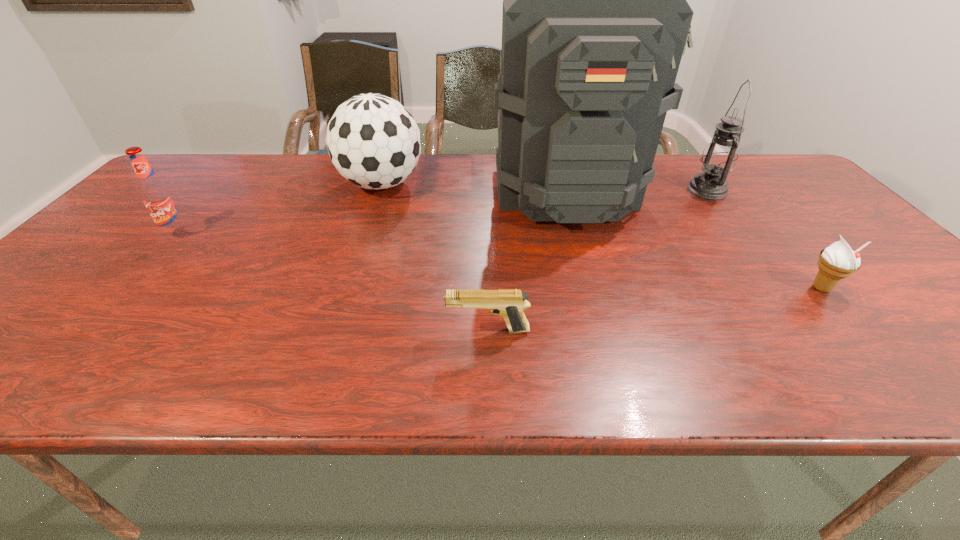
In the image, there is a desktop. Find the location of `free space at the near edge`. free space at the near edge is located at coordinates (47, 376).

Where is `free space at the left edge`? The height and width of the screenshot is (540, 960). free space at the left edge is located at coordinates (32, 308).

You are a GUI agent. You are given a task and a screenshot of the screen. Output one action in this format:
    pyautogui.click(x=<x>, y=<y>)
    Task: Click on the free space between the fifth object from right to left and the leftmost object
    This screenshot has height=540, width=960.
    Given the screenshot: What is the action you would take?
    pyautogui.click(x=279, y=209)

Where is `empty space that is in between the soccer ball and the fifth farthest object`? empty space that is in between the soccer ball and the fifth farthest object is located at coordinates (601, 236).

At what (x,y) coordinates should I click in order to perform the action: click on vacant space that's between the backpack and the shortest object. Please return your answer as a coordinate pair (x, y). Looking at the image, I should click on (526, 261).

I want to click on empty location between the oil lamp and the leftmost object, so click(x=443, y=212).

The image size is (960, 540). Identify the location of vacant area between the pistol and the oil lamp. point(597,260).

Find the location of a particular element. The image size is (960, 540). empty location between the second tallest object and the second shortest object is located at coordinates (764, 239).

Identify the location of vacant area that lies between the shortest object and the leftmost object. The height and width of the screenshot is (540, 960). (333, 282).

The image size is (960, 540). I want to click on object that stands as the second closest to the tallest object, so click(x=373, y=141).